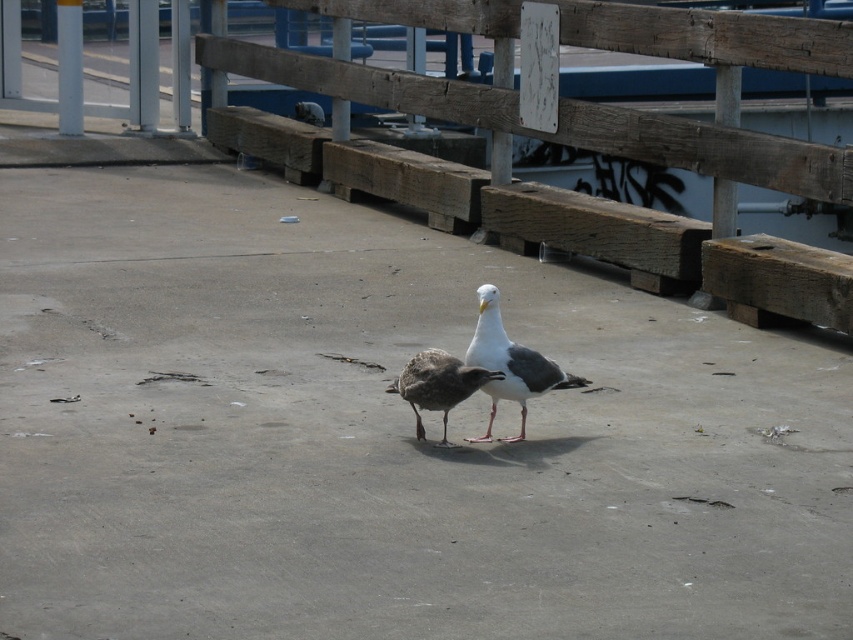
Question: Does wooden at center have a larger size compared to white matte seagull at center?

Choices:
 (A) no
 (B) yes

Answer: (A)

Question: Which is nearer to the brown feathered bird at center?

Choices:
 (A) wooden at center
 (B) white matte seagull at center

Answer: (B)

Question: Does wooden at center appear under brown feathered bird at center?

Choices:
 (A) yes
 (B) no

Answer: (B)

Question: Does wooden at center appear over white matte seagull at center?

Choices:
 (A) no
 (B) yes

Answer: (B)

Question: Which object is the closest to the brown feathered bird at center?

Choices:
 (A) white matte seagull at center
 (B) wooden at center

Answer: (A)

Question: Among these objects, which one is nearest to the camera?

Choices:
 (A) wooden at center
 (B) white matte seagull at center

Answer: (B)